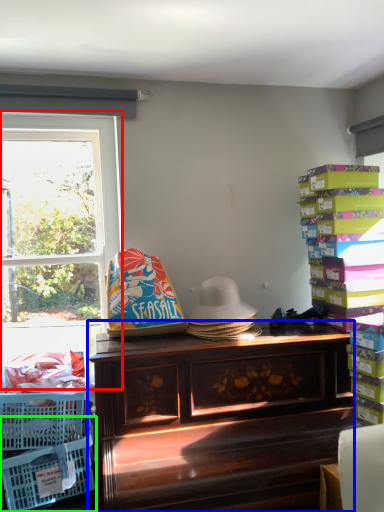
Question: Considering the real-world distances, which object is closest to window (highlighted by a red box)? desk (highlighted by a blue box) or basket (highlighted by a green box).

Choices:
 (A) desk
 (B) basket

Answer: (A)